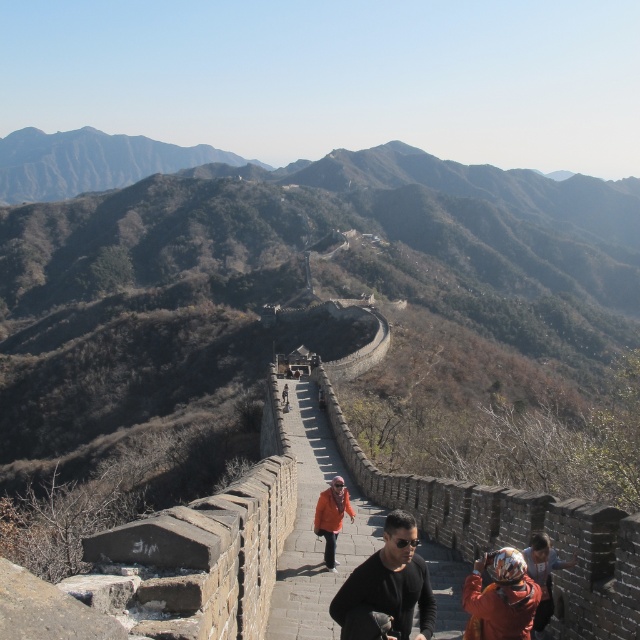
Question: Which object is positioned farthest from the black matte jacket at center?

Choices:
 (A) orange fabric headscarf at lower right
 (B) orange fabric jacket at center

Answer: (B)

Question: Is black matte jacket at center to the left of orange fabric headscarf at lower right from the viewer's perspective?

Choices:
 (A) yes
 (B) no

Answer: (A)

Question: Considering the real-world distances, which object is farthest from the orange fabric jacket at center?

Choices:
 (A) orange fabric headscarf at lower right
 (B) black matte jacket at center
 (C) orange helmet at lower right

Answer: (C)

Question: Can you confirm if orange helmet at lower right is positioned to the left of orange fabric headscarf at lower right?

Choices:
 (A) yes
 (B) no

Answer: (A)

Question: Which of the following is the farthest from the observer?

Choices:
 (A) orange helmet at lower right
 (B) orange fabric jacket at center

Answer: (B)

Question: Observing the image, what is the correct spatial positioning of black matte jacket at center in reference to orange helmet at lower right?

Choices:
 (A) below
 (B) above

Answer: (A)